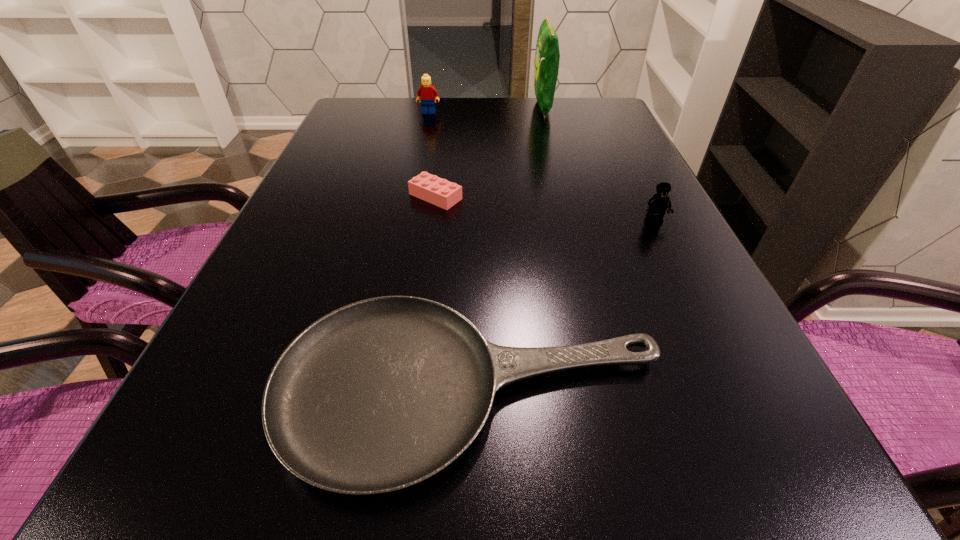
Image resolution: width=960 pixels, height=540 pixels. What are the coordinates of `vacant space located on the front-facing side of the tallest object` in the screenshot? It's located at (487, 107).

Locate an element on the screen. free space located 0.220m on the front-facing side of the tallest object is located at coordinates (461, 107).

Where is `vacant space located on the front-facing side of the fourth shortest object`? vacant space located on the front-facing side of the fourth shortest object is located at coordinates (415, 180).

Identify the location of vacant space located 0.380m on the front-facing side of the third tallest object. This screenshot has width=960, height=540. pos(733,384).

The width and height of the screenshot is (960, 540). Identify the location of vacant region located on the front of the second nearest Lego. (427, 259).

You are a GUI agent. You are given a task and a screenshot of the screen. Output one action in this format:
    pyautogui.click(x=<x>, y=<y>)
    Task: Click on the vacant region located 0.100m on the left of the shortest object
    The width and height of the screenshot is (960, 540).
    Given the screenshot: What is the action you would take?
    pyautogui.click(x=205, y=389)

Where is `crisp (potato chip) at the far edge`? This screenshot has width=960, height=540. crisp (potato chip) at the far edge is located at coordinates (547, 56).

Locate an element on the screen. The width and height of the screenshot is (960, 540). Lego that is at the far edge is located at coordinates (426, 93).

This screenshot has height=540, width=960. Identify the location of object that is at the near edge. (378, 395).

Identify the location of object at the left edge. The width and height of the screenshot is (960, 540). (378, 395).